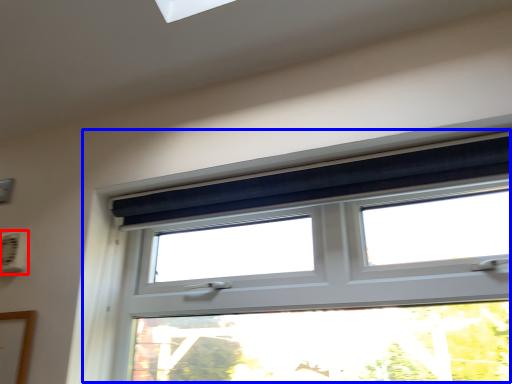
Question: Which point is further to the camera, air conditioning (highlighted by a red box) or window (highlighted by a blue box)?

Choices:
 (A) air conditioning
 (B) window

Answer: (A)